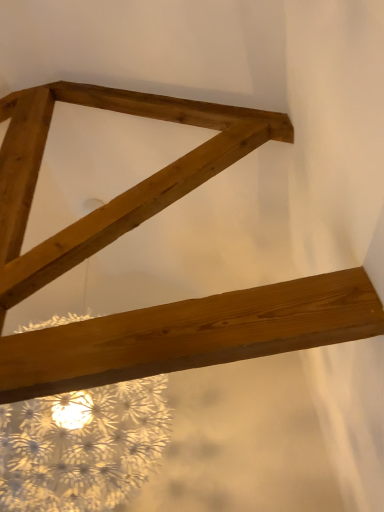
The image size is (384, 512). What do you see at coordinates (119, 195) in the screenshot?
I see `natural wood plank at upper center` at bounding box center [119, 195].

Where is `natural wood plank at upper center`? This screenshot has height=512, width=384. natural wood plank at upper center is located at coordinates (119, 195).

At what (x,y) coordinates should I click in order to perform the action: click on natural wood plank at upper center. Please return your answer as a coordinate pair (x, y). Looking at the image, I should click on pyautogui.click(x=119, y=195).